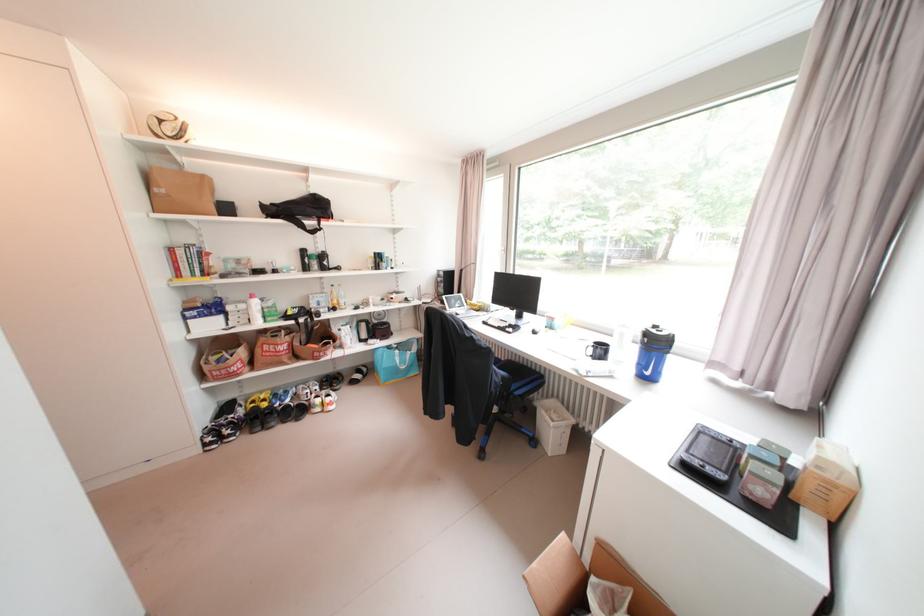
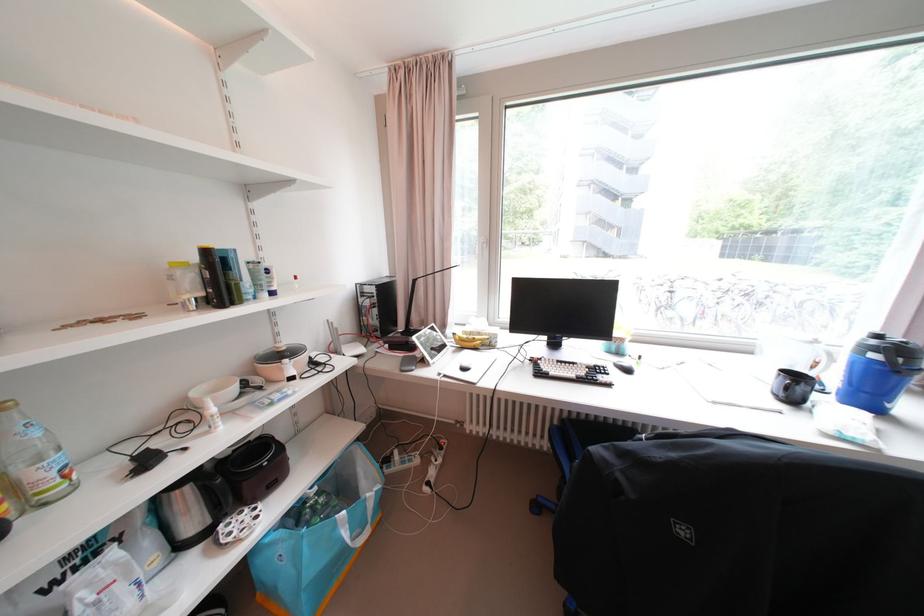
In the second image, find the point that corresponds to [479,305] in the first image.

(468, 341)